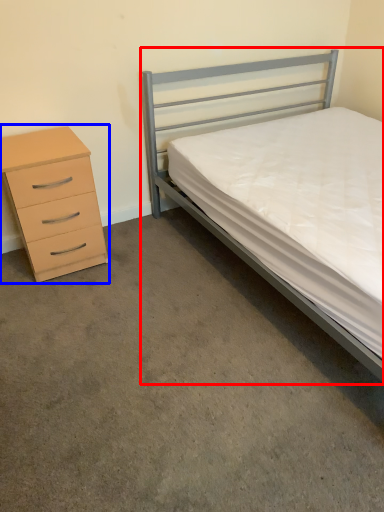
Question: Among these objects, which one is nearest to the camera, bed (highlighted by a red box) or chest of drawers (highlighted by a blue box)?

Choices:
 (A) bed
 (B) chest of drawers

Answer: (A)